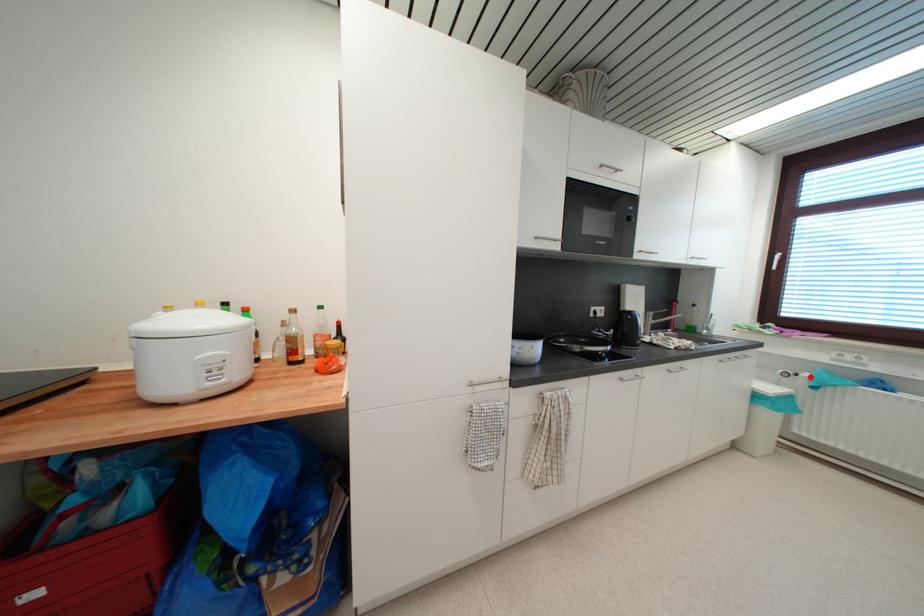
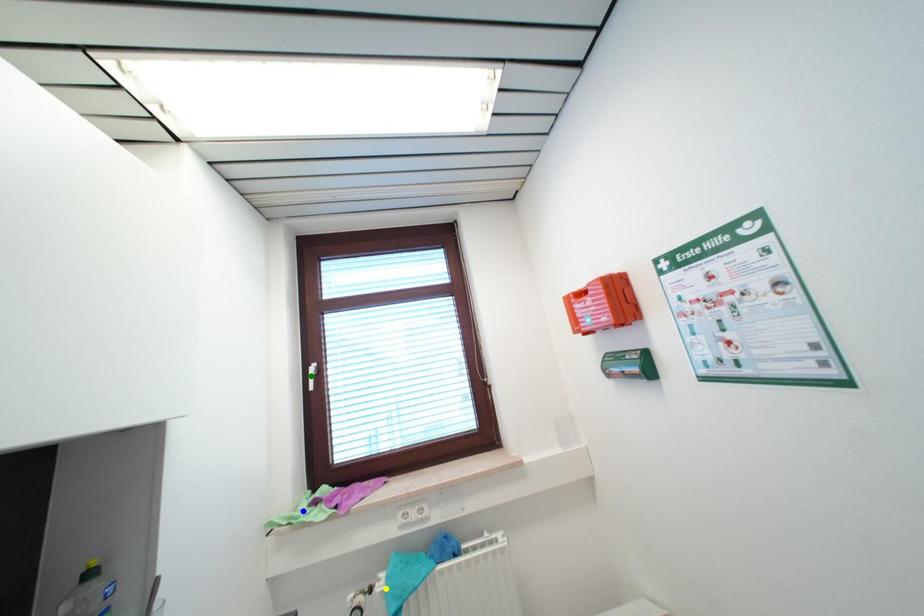
Question: I am providing you with two images of the same scene from different viewpoints. A red point is marked on the first image. You are given multiple points on the second image. Which spot in image 2 lines up with the point in image 1?

Choices:
 (A) blue point
 (B) green point
 (C) yellow point

Answer: (C)